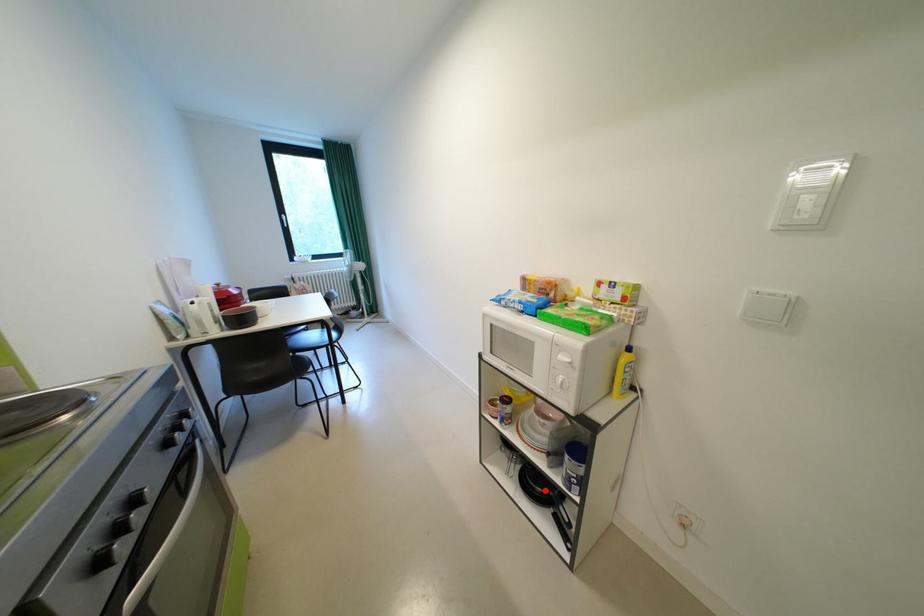
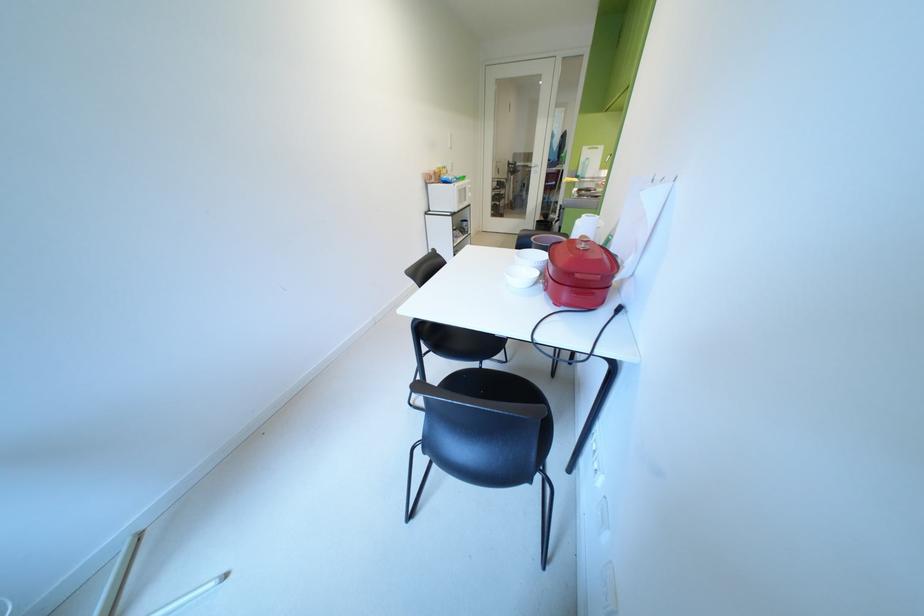
Question: I am providing you with two images of the same scene from different viewpoints. A red point is marked on the first image. Is the red point's position out of view in image 2?

Choices:
 (A) Yes
 (B) No

Answer: (A)